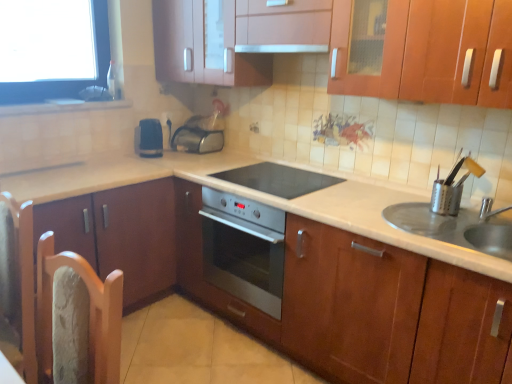
Where is `free spot above silver metallic sink at lower right (from a real-world perspective)`? free spot above silver metallic sink at lower right (from a real-world perspective) is located at coordinates (451, 212).